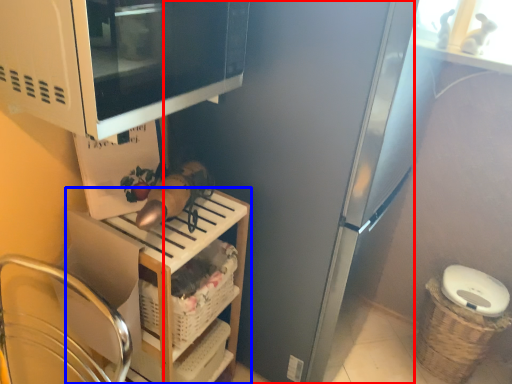
Question: Which of the following is the closest to the observer, appliance (highlighted by a red box) or shelf (highlighted by a blue box)?

Choices:
 (A) appliance
 (B) shelf

Answer: (A)